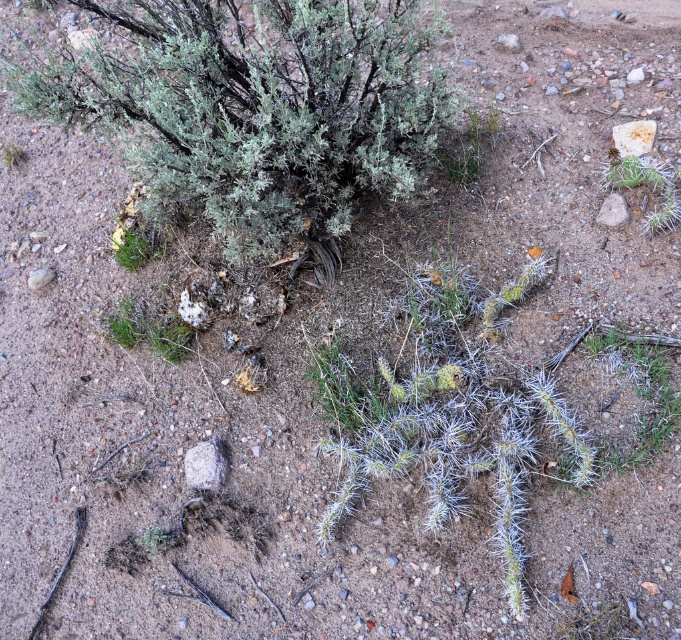
Question: Is green fuzzy bush at upper center thinner than green spiny cactus at lower right?

Choices:
 (A) yes
 (B) no

Answer: (B)

Question: Does green fuzzy bush at upper center have a greater width compared to green spiny cactus at lower right?

Choices:
 (A) yes
 (B) no

Answer: (A)

Question: Does green fuzzy plant at lower left have a larger size compared to green fuzzy bush at upper left?

Choices:
 (A) yes
 (B) no

Answer: (A)

Question: Considering the real-world distances, which object is closest to the green fuzzy bush at upper left?

Choices:
 (A) green fuzzy bush at upper center
 (B) green fuzzy plant at lower left

Answer: (B)

Question: Which object is farther from the camera taking this photo?

Choices:
 (A) green fuzzy bush at upper center
 (B) green fuzzy plant at lower left
 (C) green spiny cactus at lower right
 (D) green fuzzy bush at upper left

Answer: (D)

Question: Among these objects, which one is farthest from the camera?

Choices:
 (A) green spiny cactus at lower right
 (B) green fuzzy plant at lower left

Answer: (B)